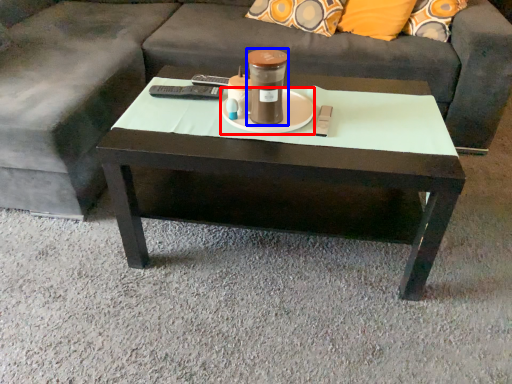
Question: Which object appears closest to the camera in this image, saucer (highlighted by a red box) or beverage (highlighted by a blue box)?

Choices:
 (A) saucer
 (B) beverage

Answer: (B)